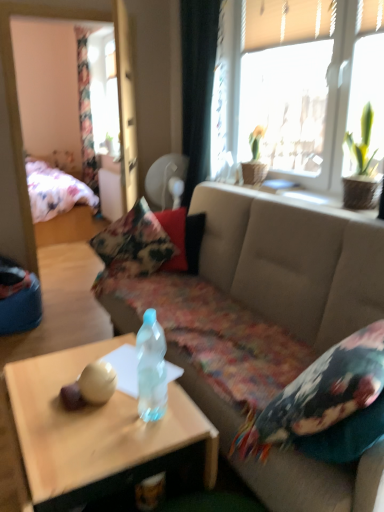
Question: Is black fabric curtain at upper center, the second curtain viewed from the left, smaller than floral fabric bed at left?

Choices:
 (A) yes
 (B) no

Answer: (A)

Question: Can you confirm if black fabric curtain at upper center, which is the 1th curtain from front to back, is shorter than floral fabric bed at left?

Choices:
 (A) no
 (B) yes

Answer: (A)

Question: Does black fabric curtain at upper center, which appears as the 2th curtain when viewed from the back, have a greater width compared to floral fabric bed at left?

Choices:
 (A) no
 (B) yes

Answer: (A)

Question: Does black fabric curtain at upper center, the second curtain viewed from the left, have a lesser width compared to floral fabric bed at left?

Choices:
 (A) yes
 (B) no

Answer: (A)

Question: Considering the relative sizes of black fabric curtain at upper center, which appears as the 2th curtain when viewed from the back, and floral fabric bed at left in the image provided, is black fabric curtain at upper center, which appears as the 2th curtain when viewed from the back, taller than floral fabric bed at left?

Choices:
 (A) yes
 (B) no

Answer: (A)

Question: Is black fabric curtain at upper center, which is the first curtain in right-to-left order, far away from floral fabric bed at left?

Choices:
 (A) no
 (B) yes

Answer: (B)

Question: Is translucent plastic bottle at center turned away from floral fabric bed at left?

Choices:
 (A) no
 (B) yes

Answer: (A)

Question: From a real-world perspective, is translucent plastic bottle at center physically below floral fabric bed at left?

Choices:
 (A) no
 (B) yes

Answer: (A)

Question: From the image's perspective, would you say translucent plastic bottle at center is shown under floral fabric bed at left?

Choices:
 (A) no
 (B) yes

Answer: (B)

Question: Considering the relative sizes of translucent plastic bottle at center and floral fabric bed at left in the image provided, is translucent plastic bottle at center taller than floral fabric bed at left?

Choices:
 (A) yes
 (B) no

Answer: (B)

Question: Is translucent plastic bottle at center smaller than floral fabric bed at left?

Choices:
 (A) yes
 (B) no

Answer: (A)

Question: From the image's perspective, would you say translucent plastic bottle at center is positioned over floral fabric bed at left?

Choices:
 (A) no
 (B) yes

Answer: (A)

Question: Is translucent plastic coffee table at center at the right side of floral fabric pillow at center, marked as the 1th pillow in a back-to-front arrangement?

Choices:
 (A) yes
 (B) no

Answer: (A)